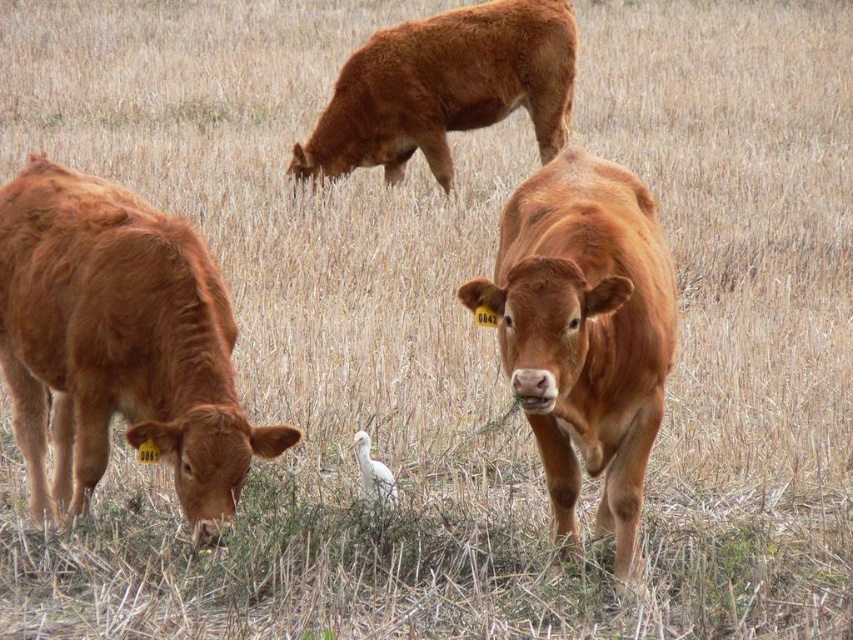
Can you confirm if shiny brown cow at center is bigger than white matte bird at center?

Yes.

Which is more to the left, shiny brown cow at center or white matte bird at center?

From the viewer's perspective, white matte bird at center appears more on the left side.

Is point (628, 356) farther from viewer compared to point (363, 458)?

No, (628, 356) is in front of (363, 458).

Locate an element on the screen. Image resolution: width=853 pixels, height=640 pixels. shiny brown cow at center is located at coordinates (585, 332).

Between shiny brown cow at left and shiny brown cow at center, which one is positioned lower?

shiny brown cow at left is below.

Identify the location of shiny brown cow at left. The width and height of the screenshot is (853, 640). (119, 344).

How far apart are shiny brown cow at left and white matte bird at center?

The distance of shiny brown cow at left from white matte bird at center is 98.84 centimeters.

Who is more forward, (125, 371) or (358, 456)?

Point (125, 371) is in front.

Does point (35, 156) lie in front of point (360, 472)?

Yes, it is in front of point (360, 472).

What are the coordinates of `shiny brown cow at left` in the screenshot? It's located at (119, 344).